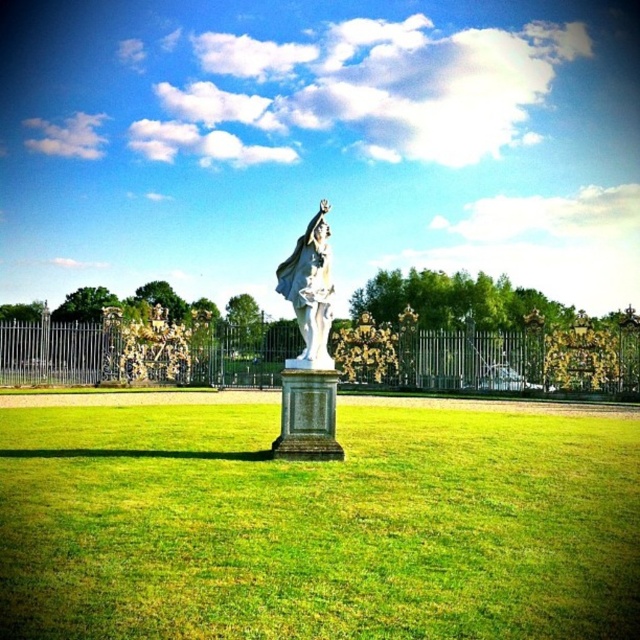
Question: Is green grass at center above white marble statue at center?

Choices:
 (A) no
 (B) yes

Answer: (A)

Question: Which object appears farthest from the camera in this image?

Choices:
 (A) white marble statue at center
 (B) green grass at center

Answer: (A)

Question: Which of the following is the farthest from the observer?

Choices:
 (A) (317, 250)
 (B) (193, 552)

Answer: (A)

Question: Is the position of green grass at center more distant than that of white marble statue at center?

Choices:
 (A) no
 (B) yes

Answer: (A)

Question: Is green grass at center above white marble statue at center?

Choices:
 (A) no
 (B) yes

Answer: (A)